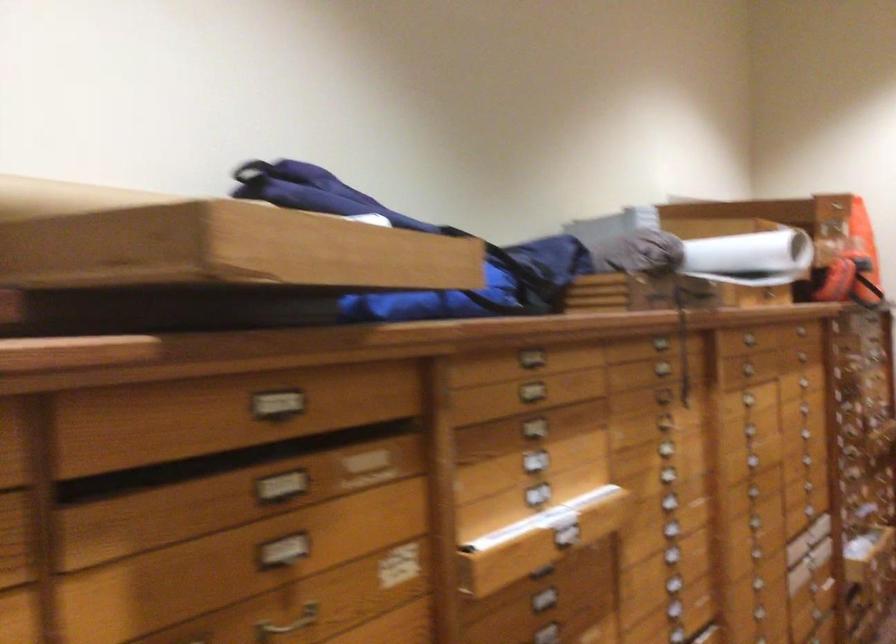
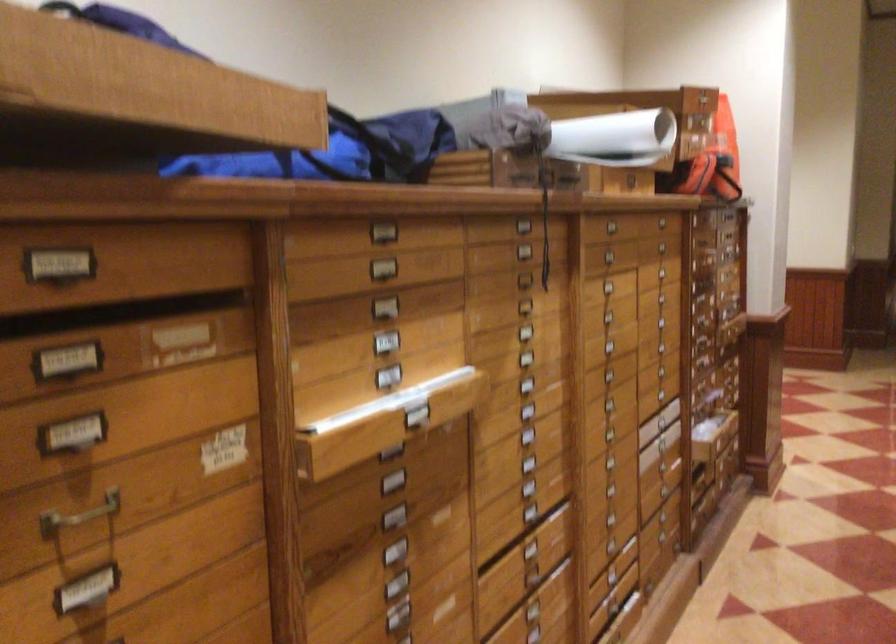
In the second image, find the point that corresponds to point (564, 532) in the first image.

(416, 411)